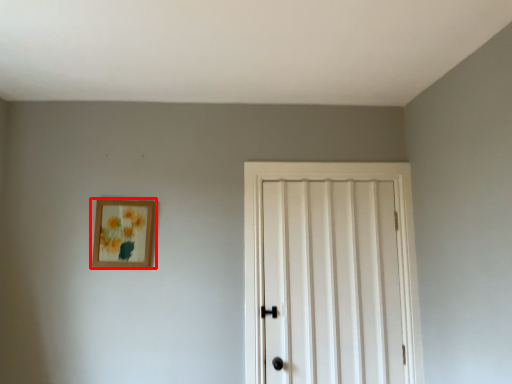
Question: From the image's perspective, what is the correct spatial relationship of picture frame (annotated by the red box) in relation to door?

Choices:
 (A) below
 (B) above

Answer: (B)